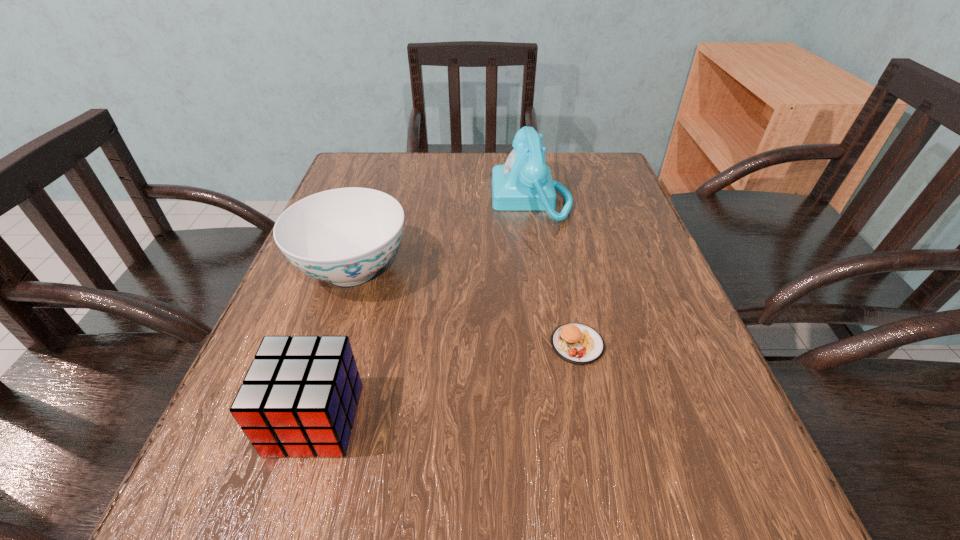
Locate an element on the screen. free space located 0.390m on the right of the cube is located at coordinates (624, 419).

The height and width of the screenshot is (540, 960). Find the location of `vacant space located 0.390m on the left of the patty`. vacant space located 0.390m on the left of the patty is located at coordinates (319, 345).

Locate an element on the screen. This screenshot has width=960, height=540. object present at the far edge is located at coordinates (524, 183).

The height and width of the screenshot is (540, 960). What are the coordinates of `chinaware present at the left edge` in the screenshot? It's located at click(344, 236).

Image resolution: width=960 pixels, height=540 pixels. Identify the location of cube situated at the left edge. (299, 397).

This screenshot has height=540, width=960. I want to click on telephone located in the right edge section of the desktop, so click(524, 183).

In order to click on patty present at the right edge in this screenshot , I will do `click(576, 343)`.

Where is `object that is positioned at the far right corner`? The width and height of the screenshot is (960, 540). object that is positioned at the far right corner is located at coordinates tap(524, 183).

The image size is (960, 540). I want to click on vacant space at the far edge, so click(424, 190).

In the image, there is a desktop. In order to click on vacant space at the near edge in this screenshot , I will do `click(372, 528)`.